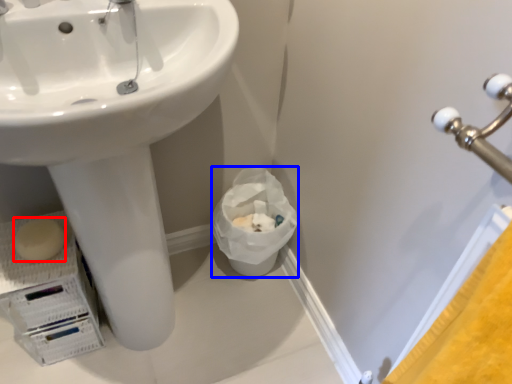
Question: Among these objects, which one is nearest to the camera, soap (highlighted by a red box) or garbage (highlighted by a blue box)?

Choices:
 (A) soap
 (B) garbage

Answer: (A)